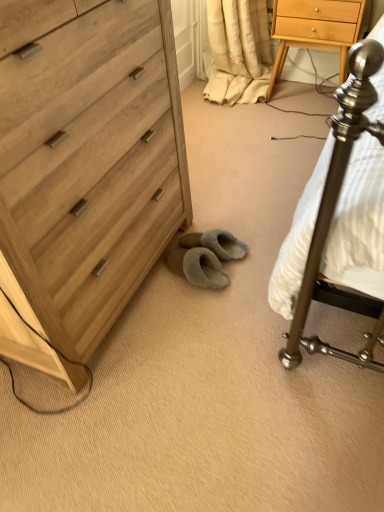
What do you see at coordinates (315, 29) in the screenshot? This screenshot has height=512, width=384. I see `light wood/finish nightstand at upper right` at bounding box center [315, 29].

Image resolution: width=384 pixels, height=512 pixels. Find the location of `light wood/finish nightstand at upper right`. light wood/finish nightstand at upper right is located at coordinates (315, 29).

This screenshot has width=384, height=512. Identify the location of light wood chest of drawers at left. (90, 168).

Image resolution: width=384 pixels, height=512 pixels. Describe the element at coordinates (90, 168) in the screenshot. I see `light wood chest of drawers at left` at that location.

Image resolution: width=384 pixels, height=512 pixels. Find the location of `light wood/finish nightstand at upper right`. light wood/finish nightstand at upper right is located at coordinates (315, 29).

Between light wood/finish nightstand at upper right and light wood chest of drawers at left, which one appears on the left side from the viewer's perspective?

From the viewer's perspective, light wood chest of drawers at left appears more on the left side.

Is light wood/finish nightstand at upper right positioned in front of light wood chest of drawers at left?

No, the depth of light wood/finish nightstand at upper right is greater than that of light wood chest of drawers at left.

Considering the points (354, 10) and (87, 332), which point is in front, point (354, 10) or point (87, 332)?

Point (87, 332)

From the image's perspective, which is above, light wood/finish nightstand at upper right or light wood chest of drawers at left?

light wood/finish nightstand at upper right appears higher in the image.

From a real-world perspective, is light wood/finish nightstand at upper right physically located above or below light wood chest of drawers at left?

In terms of real-world spatial position, light wood/finish nightstand at upper right is below light wood chest of drawers at left.

Can you confirm if light wood/finish nightstand at upper right is wider than light wood chest of drawers at left?

Incorrect, the width of light wood/finish nightstand at upper right does not surpass that of light wood chest of drawers at left.

From the picture: Who is taller, light wood/finish nightstand at upper right or light wood chest of drawers at left?

light wood chest of drawers at left.

Which of these two, light wood/finish nightstand at upper right or light wood chest of drawers at left, is bigger?

light wood chest of drawers at left is bigger.

Is light wood/finish nightstand at upper right not inside light wood chest of drawers at left?

light wood/finish nightstand at upper right lies outside light wood chest of drawers at left's area.

Is light wood/finish nightstand at upper right next to light wood chest of drawers at left and touching it?

No, light wood/finish nightstand at upper right is not in contact with light wood chest of drawers at left.

Looking at this image, does light wood/finish nightstand at upper right turn towards light wood chest of drawers at left?

No, light wood/finish nightstand at upper right is not oriented towards light wood chest of drawers at left.

Locate an element on the screen. the chest of drawers that is above the light wood/finish nightstand at upper right (from a real-world perspective) is located at coordinates (90, 168).

Which is more to the left, light wood chest of drawers at left or light wood/finish nightstand at upper right?

Positioned to the left is light wood chest of drawers at left.

Considering their positions, is light wood chest of drawers at left located in front of or behind light wood/finish nightstand at upper right?

In the image, light wood chest of drawers at left appears in front of light wood/finish nightstand at upper right.

Is point (52, 79) more distant than point (320, 18)?

No, it is in front of (320, 18).

From the image's perspective, which one is positioned lower, light wood chest of drawers at left or light wood/finish nightstand at upper right?

From the image's view, light wood chest of drawers at left is below.

From a real-world perspective, is light wood chest of drawers at left below light wood/finish nightstand at upper right?

No.

From the picture: Which object is thinner, light wood chest of drawers at left or light wood/finish nightstand at upper right?

light wood/finish nightstand at upper right.

Can you confirm if light wood chest of drawers at left is taller than light wood/finish nightstand at upper right?

Yes, light wood chest of drawers at left is taller than light wood/finish nightstand at upper right.

Does light wood chest of drawers at left have a smaller size compared to light wood/finish nightstand at upper right?

Incorrect, light wood chest of drawers at left is not smaller in size than light wood/finish nightstand at upper right.

Is light wood chest of drawers at left situated inside light wood/finish nightstand at upper right or outside?

light wood chest of drawers at left is not enclosed by light wood/finish nightstand at upper right.

From the picture: Would you consider light wood chest of drawers at left to be distant from light wood/finish nightstand at upper right?

Yes.

Is light wood/finish nightstand at upper right at the back of light wood chest of drawers at left?

light wood chest of drawers at left does not have its back to light wood/finish nightstand at upper right.

Based on the photo, can you tell me how much light wood chest of drawers at left and light wood/finish nightstand at upper right differ in facing direction?

The angle between the facing direction of light wood chest of drawers at left and the facing direction of light wood/finish nightstand at upper right is 177 degrees.

Identify the location of nightstand located behind the light wood chest of drawers at left. (315, 29).

This screenshot has width=384, height=512. I want to click on the chest of drawers in front of the light wood/finish nightstand at upper right, so click(90, 168).

Identify the location of nightstand behind the light wood chest of drawers at left. Image resolution: width=384 pixels, height=512 pixels. (315, 29).